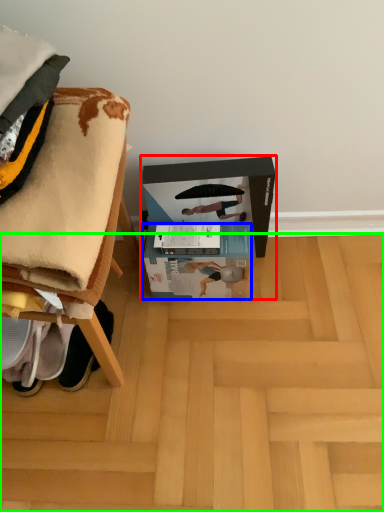
Question: Estimate the real-world distances between objects in this image. Which object is closer to cardboard box (highlighted by a red box), box (highlighted by a blue box) or wood (highlighted by a green box)?

Choices:
 (A) box
 (B) wood

Answer: (A)